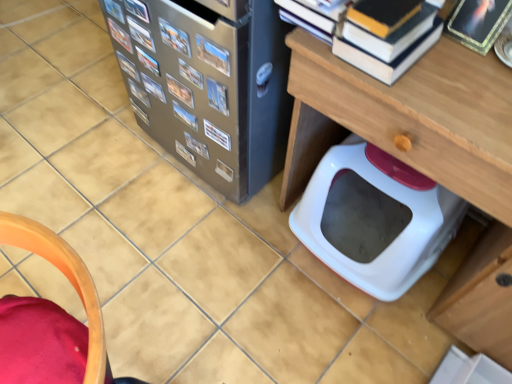
Question: From the image's perspective, relative to metallic silver book at center, the 9th book viewed from the front, is hardcover book at upper right, the 1th book from the front, above or below?

Choices:
 (A) below
 (B) above

Answer: (B)

Question: Is point [342, 36] positioned closer to the camera than point [174, 81]?

Choices:
 (A) closer
 (B) farther

Answer: (A)

Question: Considering the real-world distances, which object is closest to the metallic silver book at center, which ranks as the tenth book in front-to-back order?

Choices:
 (A) wooden chair at lower left
 (B) wooden table at lower right
 (C) metallic photo album at upper center, marked as the 13th book in a back-to-front arrangement
 (D) metallic silver book at center, positioned as the twelfth book in front-to-back order
 (E) matte paper paperback book at center

Answer: (D)

Question: Which object is the farthest from the matte paper paperback book at center?

Choices:
 (A) metallic silver book at upper left, positioned as the seventh book in front-to-back order
 (B) metallic silver book at center, which is the 14th book from back to front
 (C) metallic silver book at upper left, the 8th book when ordered from front to back
 (D) metallic silver book at center, placed as the 6th book when sorted from back to front
 (E) metallic silver book at upper left, placed as the twelfth book when sorted from back to front

Answer: (C)